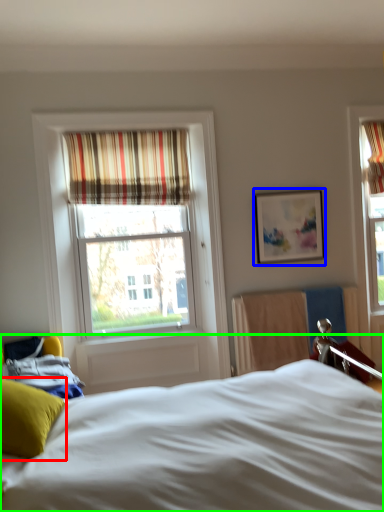
Question: Which is farther away from pillow (highlighted by a red box)? picture frame (highlighted by a blue box) or bed (highlighted by a green box)?

Choices:
 (A) picture frame
 (B) bed

Answer: (A)